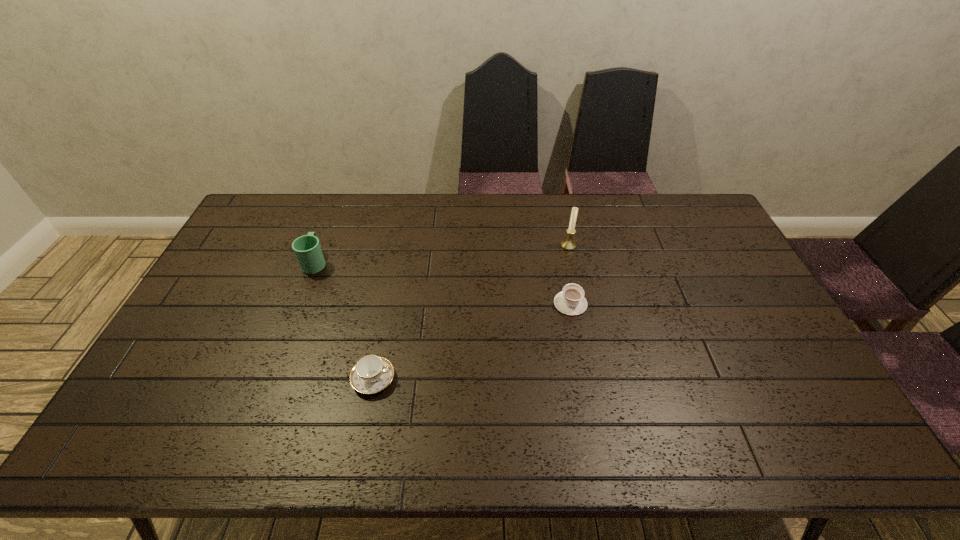
You are a GUI agent. You are given a task and a screenshot of the screen. Output one action in this format:
    pyautogui.click(x=<x>, y=<y>)
    Task: Click on the candle holder
    The width and height of the screenshot is (960, 540).
    Given the screenshot: What is the action you would take?
    pyautogui.click(x=569, y=244)

Find the location of a particular element. Image resolution: width=960 pixels, height=540 pixels. the leftmost object is located at coordinates (307, 248).

Find the location of a particular element. This screenshot has height=540, width=960. the third shortest object is located at coordinates point(307,248).

Locate an element on the screen. the nearest object is located at coordinates (371, 374).

Where is `the left teacup`? The width and height of the screenshot is (960, 540). the left teacup is located at coordinates (371, 374).

The height and width of the screenshot is (540, 960). Find the location of `the farther teacup`. the farther teacup is located at coordinates (571, 301).

Where is `the third farthest object`? The image size is (960, 540). the third farthest object is located at coordinates (571, 301).

Locate an element on the screen. vacant space located 0.050m on the left of the candle holder is located at coordinates (546, 246).

This screenshot has width=960, height=540. In order to click on vacant region located 0.220m on the side of the second tallest object with the handle in this screenshot , I will do `click(335, 211)`.

I want to click on blank area located 0.170m on the side of the second tallest object with the handle, so click(332, 220).